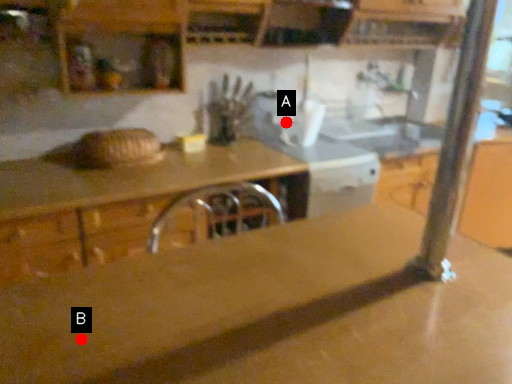
Question: Two points are circled on the image, labeled by A and B beside each circle. Among these points, which one is nearest to the camera?

Choices:
 (A) A is closer
 (B) B is closer

Answer: (B)